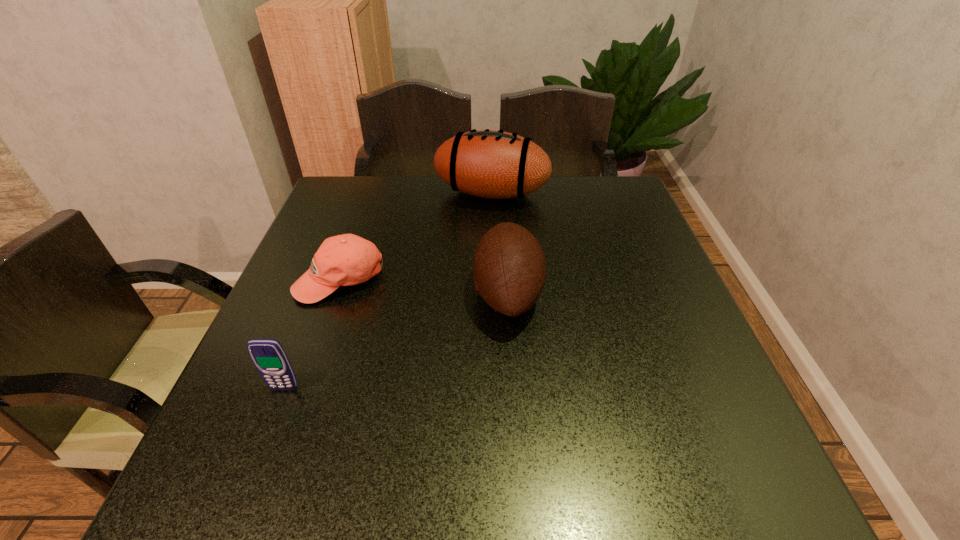
Identify which object is the second nearest to the second tallest object. Please provide its 2D coordinates. Your answer should be formatted as a tuple, i.e. [(x, y)], where the tuple contains the x and y coordinates of a point satisfying the conditions above.

[(343, 260)]

What are the coordinates of `object that is the closest to the nearest object` in the screenshot? It's located at (343, 260).

The width and height of the screenshot is (960, 540). I want to click on vacant space that satisfies the following two spatial constraints: 1. on the laces of the third shortest object; 2. on the front-facing side of the cellular telephone, so click(x=514, y=388).

Identify the location of free location that satisfies the following two spatial constraints: 1. on the laces of the shorter football; 2. on the front-facing side of the nearest object. This screenshot has height=540, width=960. (514, 388).

The width and height of the screenshot is (960, 540). In order to click on vacant space that satisfies the following two spatial constraints: 1. on the laces of the shorter football; 2. on the front-facing side of the cellular telephone in this screenshot , I will do `click(514, 388)`.